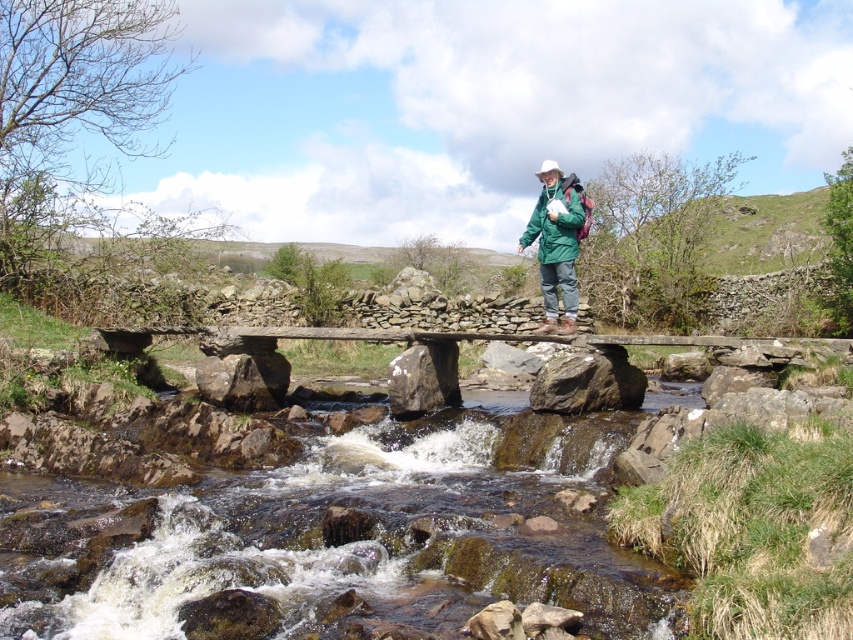
Question: Is rocky brown river at center to the left of stone bridge at center from the viewer's perspective?

Choices:
 (A) yes
 (B) no

Answer: (A)

Question: Estimate the real-world distances between objects in this image. Which object is closer to the green fabric jacket at center?

Choices:
 (A) stone bridge at center
 (B) rocky brown river at center
 (C) green matte jacket at upper center

Answer: (C)

Question: Is stone bridge at center bigger than green matte jacket at upper center?

Choices:
 (A) no
 (B) yes

Answer: (B)

Question: Does stone bridge at center appear on the right side of green matte jacket at upper center?

Choices:
 (A) no
 (B) yes

Answer: (B)

Question: Estimate the real-world distances between objects in this image. Which object is closer to the green fabric jacket at center?

Choices:
 (A) rocky brown river at center
 (B) stone bridge at center
 (C) green matte jacket at upper center

Answer: (C)

Question: Based on their relative distances, which object is nearer to the rocky brown river at center?

Choices:
 (A) green fabric jacket at center
 (B) green matte jacket at upper center

Answer: (A)